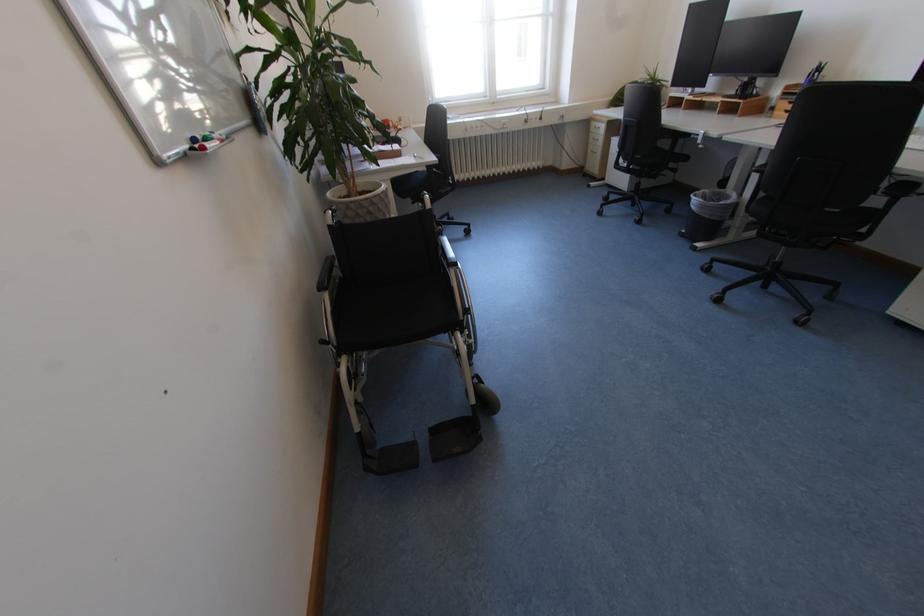
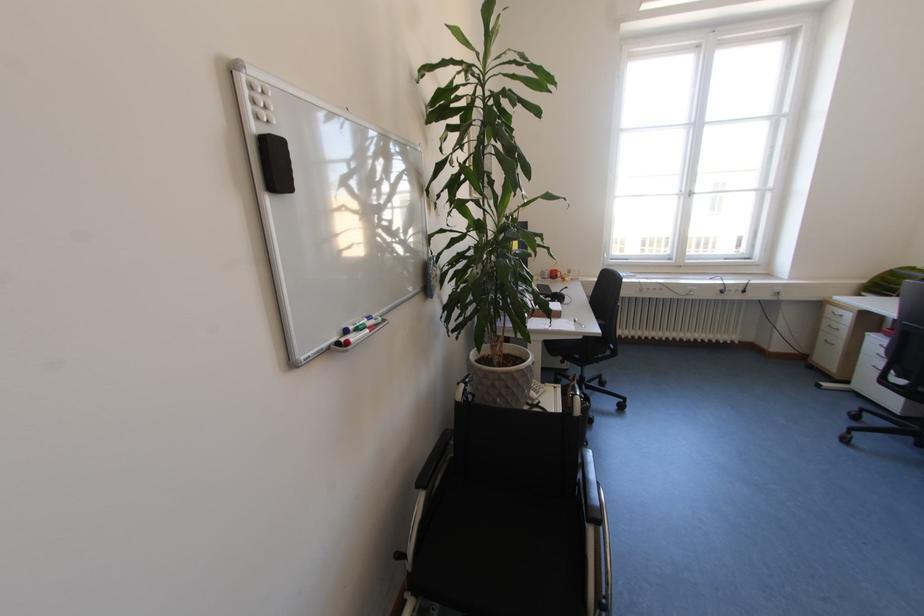
Where in the second image is the point corresponding to (459,260) from the first image?

(602, 508)